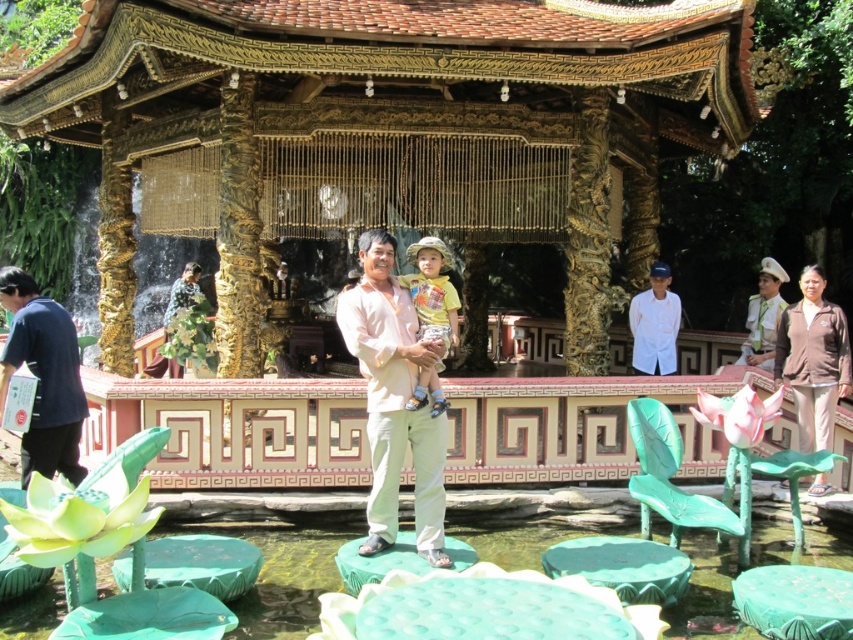
In the scene shown: Is green plastic lotus at center positioned before brown matte jacket at lower right?

That is True.

This screenshot has height=640, width=853. Find the location of `green plastic lotus at center`. green plastic lotus at center is located at coordinates (282, 577).

Is gold ornate gazebo at center behind green plastic lotus at center?

That is True.

Which is more to the right, gold ornate gazebo at center or green plastic lotus at center?

green plastic lotus at center

This screenshot has width=853, height=640. What do you see at coordinates (387, 131) in the screenshot?
I see `gold ornate gazebo at center` at bounding box center [387, 131].

Where is `gold ornate gazebo at center`? The image size is (853, 640). gold ornate gazebo at center is located at coordinates (387, 131).

Is point (366, 257) positioned after point (660, 321)?

No, (366, 257) is in front of (660, 321).

Is light beige cotton shirt at center bigger than white cotton shirt at upper right?

Yes.

Is point (367, 545) farther from camera compared to point (660, 301)?

That is False.

Where is `light beige cotton shirt at center`? light beige cotton shirt at center is located at coordinates (393, 400).